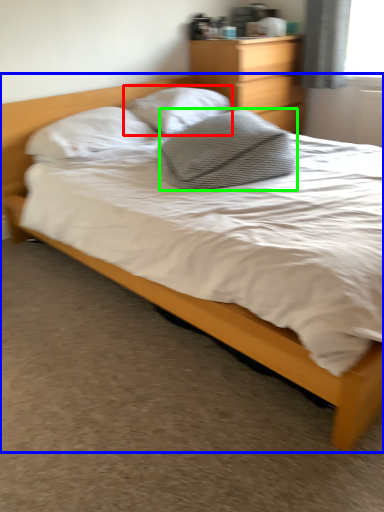
Question: Estimate the real-world distances between objects in this image. Which object is farther from pillow (highlighted by a red box), bed (highlighted by a blue box) or pillow (highlighted by a green box)?

Choices:
 (A) bed
 (B) pillow

Answer: (A)